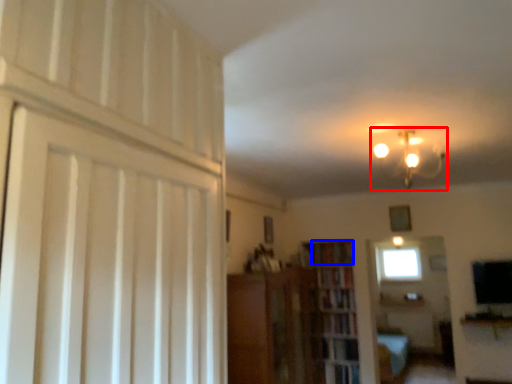
Question: Which object is further to the camera taking this photo, lamp (highlighted by a red box) or book (highlighted by a blue box)?

Choices:
 (A) lamp
 (B) book

Answer: (B)